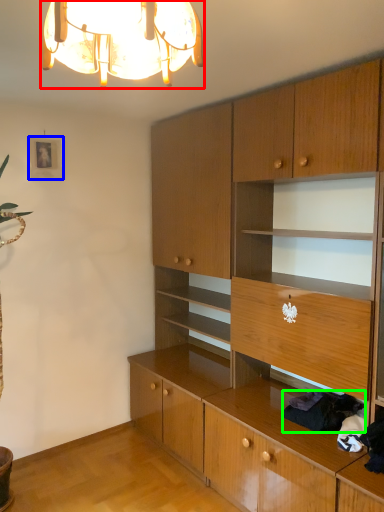
Question: Which object is positioned closest to lamp (highlighted by a red box)? Select from picture frame (highlighted by a blue box) and clothing (highlighted by a green box).

Choices:
 (A) picture frame
 (B) clothing

Answer: (B)